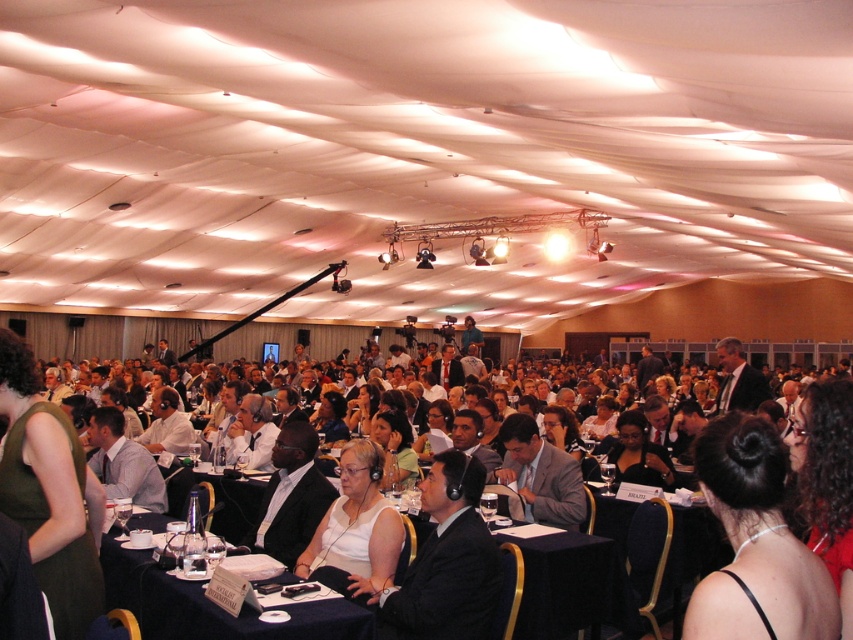
You are an event organizer who needs to arrange a photo shoot for attendees. The photographer wants to ensure that the green fabric dress at lower left and the white matte shirt at center are both visible in the frame. Considering their heights, which attendee should be positioned closer to the front to avoid blocking the other?

The green fabric dress at lower left is much taller than the white matte shirt at center, so the white matte shirt at center should be positioned closer to the front to avoid being blocked by the taller green fabric dress at lower left.

You are organizing a photo shoot and need to ensure that the white shirt at center and the light gray suit at center are both visible in the frame. Based on their positions, which one might require more space to accommodate its width?

The white shirt at center might require more space to accommodate its width since it is wider than the light gray suit at center.

You are a photographer at the event and need to capture a photo of both the green fabric dress at lower left and the white matte shirt at center. Based on their positions, which one should you focus on first to ensure both are in frame?

The green fabric dress at lower left is above the white matte shirt at center, so you should focus on the white matte shirt at center first to ensure both are in frame.